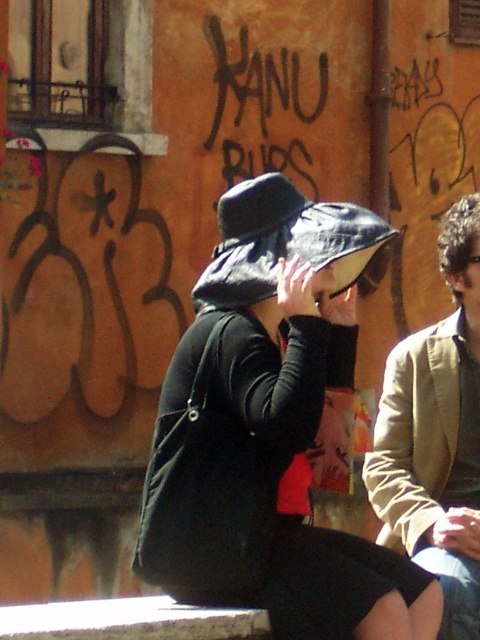
Question: Is matte black hat at center wider than matte black hat at upper center?

Choices:
 (A) no
 (B) yes

Answer: (B)

Question: Which point is farther to the camera?

Choices:
 (A) matte black hat at upper center
 (B) matte black hat at center
 (C) tan fabric jacket at right

Answer: (A)

Question: Based on their relative distances, which object is farther from the matte black hat at upper center?

Choices:
 (A) tan fabric jacket at right
 (B) matte black hat at center

Answer: (B)

Question: Can you confirm if matte black hat at center is bigger than tan fabric jacket at right?

Choices:
 (A) yes
 (B) no

Answer: (A)

Question: Which is farther from the matte black hat at upper center?

Choices:
 (A) tan fabric jacket at right
 (B) matte black hat at center

Answer: (B)

Question: Can you confirm if matte black hat at center is positioned to the left of matte black hat at upper center?

Choices:
 (A) yes
 (B) no

Answer: (A)